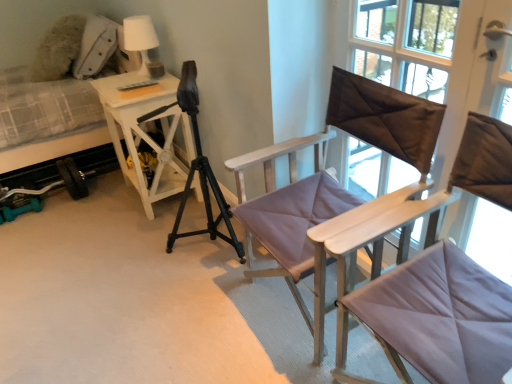
Question: Is the position of light purple fabric chair at center, which is the 2th chair from front to back, more distant than that of matte purple cushioned chair at center, which is the second chair from back to front?

Choices:
 (A) no
 (B) yes

Answer: (B)

Question: Is matte purple cushioned chair at center, which is the second chair from back to front, a part of light purple fabric chair at center, which is the 2th chair from front to back?

Choices:
 (A) no
 (B) yes

Answer: (A)

Question: Can you confirm if light purple fabric chair at center, which is the 2th chair from front to back, is thinner than matte purple cushioned chair at center, which is the second chair from back to front?

Choices:
 (A) yes
 (B) no

Answer: (A)

Question: Does light purple fabric chair at center, which is the 2th chair from front to back, have a smaller size compared to matte purple cushioned chair at center, which is the first chair from front to back?

Choices:
 (A) no
 (B) yes

Answer: (B)

Question: Does light purple fabric chair at center, which is the 2th chair from front to back, have a larger size compared to matte purple cushioned chair at center, which is the first chair from front to back?

Choices:
 (A) yes
 (B) no

Answer: (B)

Question: Can you confirm if light purple fabric chair at center, which is the 2th chair from front to back, is shorter than matte purple cushioned chair at center, which is the first chair from front to back?

Choices:
 (A) yes
 (B) no

Answer: (A)

Question: Could you tell me if light purple fabric chair at center, which is the 2th chair from front to back, is facing brown satin pillow at upper right?

Choices:
 (A) no
 (B) yes

Answer: (A)

Question: From a real-world perspective, is light purple fabric chair at center, which is the 2th chair from front to back, under brown satin pillow at upper right?

Choices:
 (A) yes
 (B) no

Answer: (A)

Question: Does light purple fabric chair at center, marked as the 1th chair in a back-to-front arrangement, have a lesser width compared to brown satin pillow at upper right?

Choices:
 (A) no
 (B) yes

Answer: (A)

Question: Can you confirm if light purple fabric chair at center, marked as the 1th chair in a back-to-front arrangement, is wider than brown satin pillow at upper right?

Choices:
 (A) yes
 (B) no

Answer: (A)

Question: Is light purple fabric chair at center, marked as the 1th chair in a back-to-front arrangement, at the left side of brown satin pillow at upper right?

Choices:
 (A) no
 (B) yes

Answer: (B)

Question: Is light purple fabric chair at center, marked as the 1th chair in a back-to-front arrangement, closer to the viewer compared to brown satin pillow at upper right?

Choices:
 (A) yes
 (B) no

Answer: (A)

Question: From a real-world perspective, is plush fabric hospital bed at left physically above brown satin pillow at upper right?

Choices:
 (A) yes
 (B) no

Answer: (B)